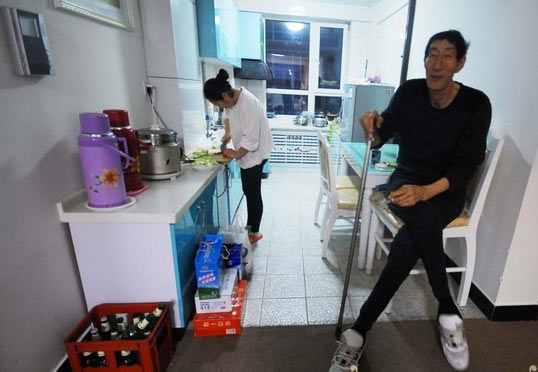
The height and width of the screenshot is (372, 538). In order to click on refrigerator in this screenshot , I will do `click(358, 96)`.